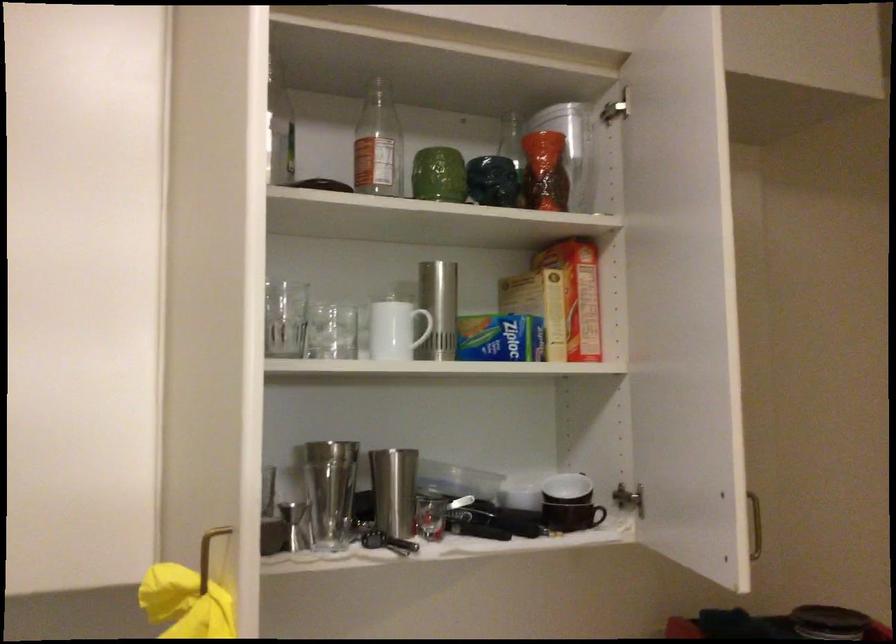
Where would you lift the brown mug handle? Please return your answer as a coordinate pair (x, y).

(591, 516)